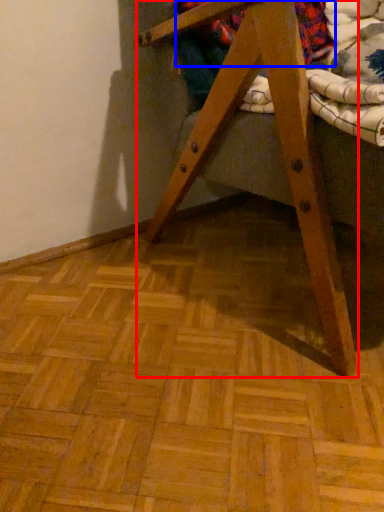
Question: Which point is closer to the camera, furniture (highlighted by a red box) or underclothes (highlighted by a blue box)?

Choices:
 (A) furniture
 (B) underclothes

Answer: (A)